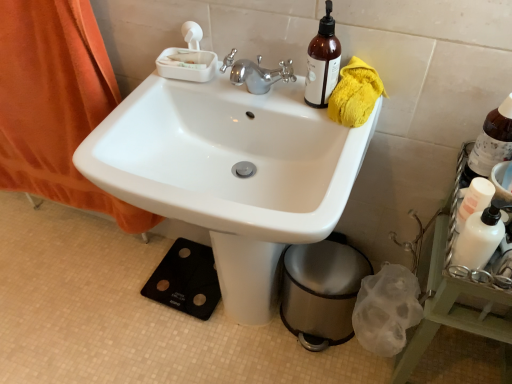
Question: Does metallic trash can at lower right have a lesser height compared to brown glass bottle at upper right, which is the 1th bottle in right-to-left order?

Choices:
 (A) no
 (B) yes

Answer: (A)

Question: Is metallic trash can at lower right not close to brown glass bottle at upper right, marked as the 3th bottle in a left-to-right arrangement?

Choices:
 (A) yes
 (B) no

Answer: (B)

Question: Is metallic trash can at lower right positioned with its back to brown glass bottle at upper right, which is the 1th bottle in right-to-left order?

Choices:
 (A) yes
 (B) no

Answer: (B)

Question: From a real-world perspective, is metallic trash can at lower right below brown glass bottle at upper right, the second bottle in the bottom-to-top sequence?

Choices:
 (A) yes
 (B) no

Answer: (A)

Question: Is the position of metallic trash can at lower right more distant than that of brown glass bottle at upper right, the second bottle in the bottom-to-top sequence?

Choices:
 (A) no
 (B) yes

Answer: (B)

Question: Is metallic trash can at lower right not within brown glass bottle at upper right, marked as the 3th bottle in a left-to-right arrangement?

Choices:
 (A) yes
 (B) no

Answer: (A)

Question: Is white glossy sink at center turned away from white matte bottle at right?

Choices:
 (A) yes
 (B) no

Answer: (B)

Question: Considering the relative sizes of white glossy sink at center and white matte bottle at right in the image provided, is white glossy sink at center wider than white matte bottle at right?

Choices:
 (A) yes
 (B) no

Answer: (A)

Question: Can you see white glossy sink at center touching white matte bottle at right?

Choices:
 (A) no
 (B) yes

Answer: (A)

Question: From a real-world perspective, is white glossy sink at center located beneath white matte bottle at right?

Choices:
 (A) no
 (B) yes

Answer: (B)

Question: Would you consider white glossy sink at center to be distant from white matte bottle at right?

Choices:
 (A) no
 (B) yes

Answer: (A)

Question: Considering the relative positions of white glossy sink at center and white matte bottle at right in the image provided, is white glossy sink at center in front of white matte bottle at right?

Choices:
 (A) yes
 (B) no

Answer: (B)

Question: Is metallic trash can at lower right at the right side of white matte bottle at right?

Choices:
 (A) yes
 (B) no

Answer: (B)